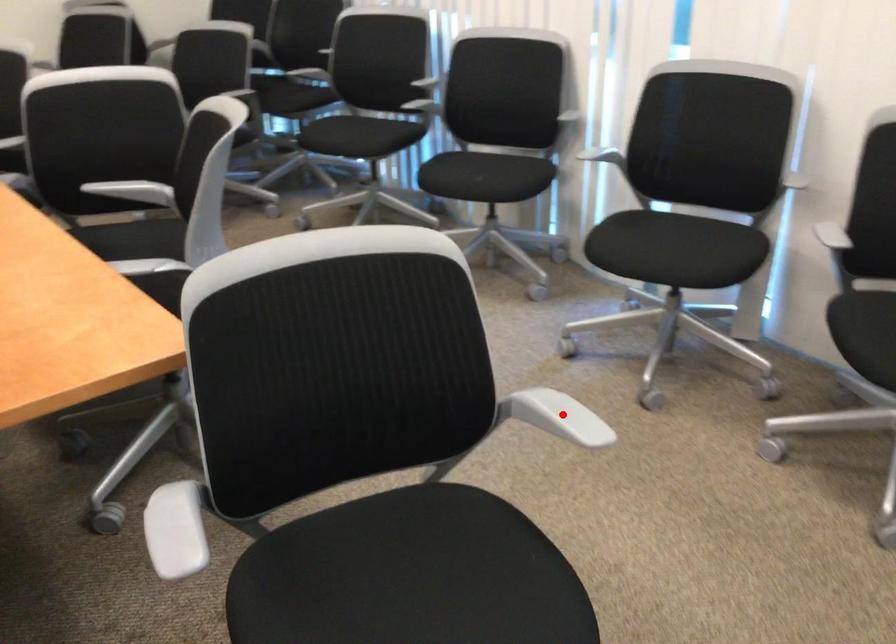
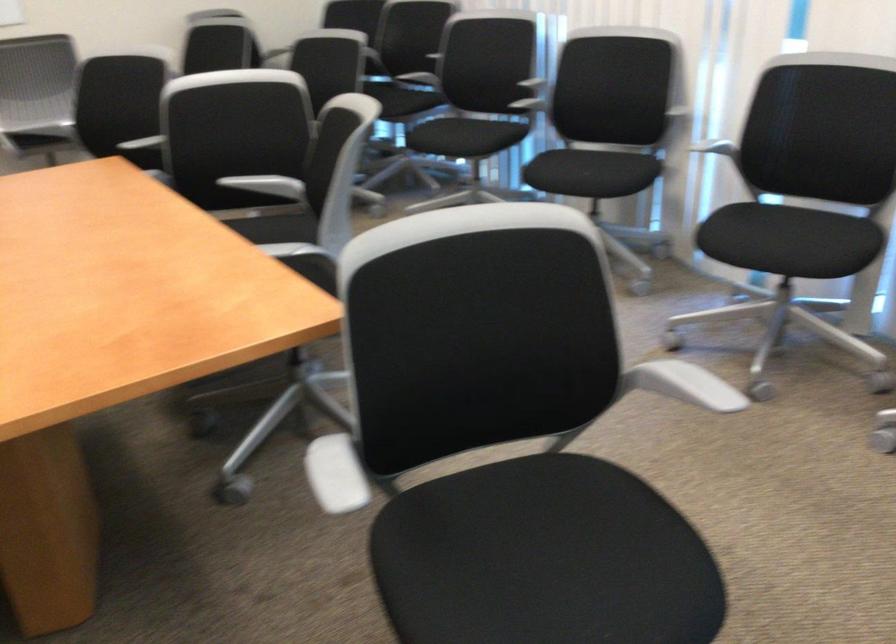
The point at the highlighted location is marked in the first image. Where is the corresponding point in the second image?

(682, 384)